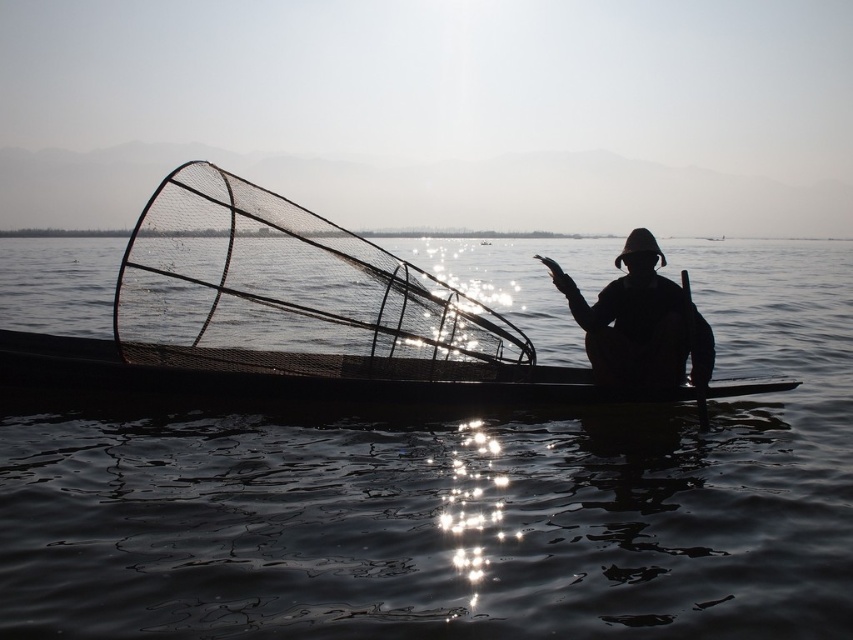
You are standing on the shore of the lake and see the transparent water at center and the smooth wood canoe at center. Which object is positioned to the right of the other?

The transparent water at center is to the right of the smooth wood canoe at center.

You are a photographer trying to capture the reflection of the mountains in the water. Since the transparent water at center and smooth wood canoe at center are both in the frame, which one would better reflect the mountains?

The transparent water at center has a larger size compared to smooth wood canoe at center, so it would provide a better reflection of the mountains because larger surfaces can mirror landscapes more effectively.